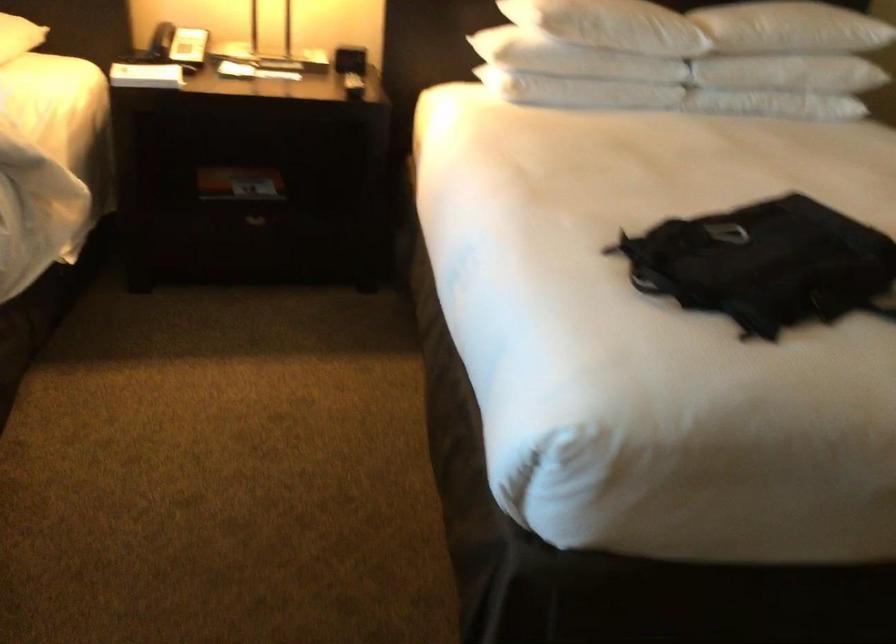
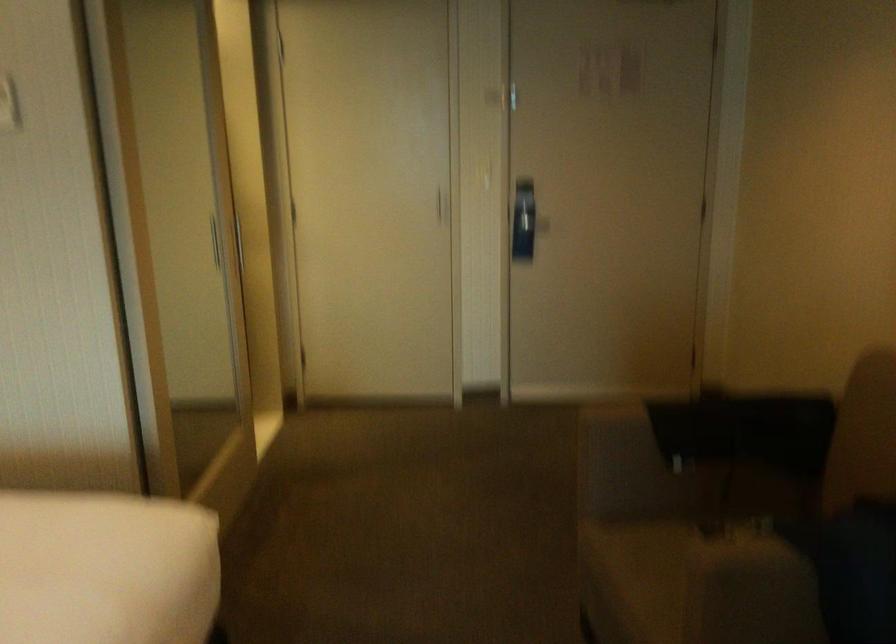
Question: The camera is either moving clockwise (left) or counter-clockwise (right) around the object. The first image is from the beginning of the video and the second image is from the end. Is the camera moving left or right when shooting the video?

Choices:
 (A) Left
 (B) Right

Answer: (A)